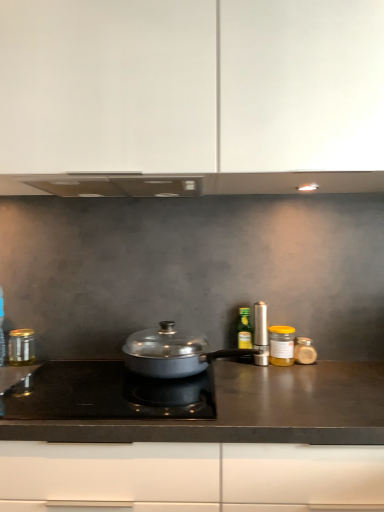
The width and height of the screenshot is (384, 512). Identify the location of free space in front of silver metallic salt shaker at right, the 3th kitchen appliance positioned from the right. (272, 378).